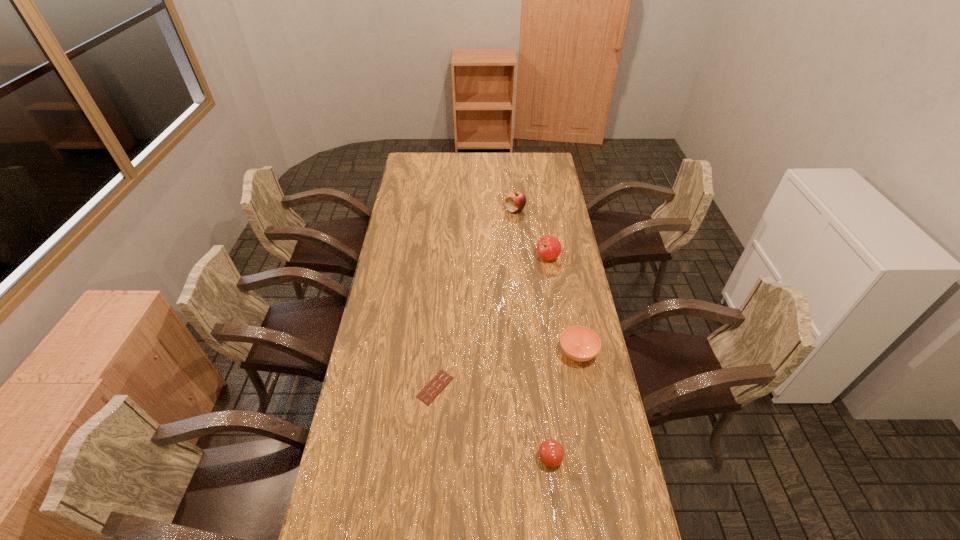
Identify the location of the farthest apple. This screenshot has height=540, width=960. (515, 201).

Locate an element on the screen. the second farthest object is located at coordinates 548,247.

The image size is (960, 540). I want to click on the nearest object, so click(x=551, y=453).

Where is `the shortest apple`? The image size is (960, 540). the shortest apple is located at coordinates (551, 453).

Image resolution: width=960 pixels, height=540 pixels. I want to click on the second shortest object, so click(x=579, y=343).

Find the location of a particular element. the shortest object is located at coordinates (442, 379).

This screenshot has width=960, height=540. I want to click on the leftmost object, so pos(442,379).

Find the location of a particular element. The height and width of the screenshot is (540, 960). vacant space located 0.250m on the back of the farthest apple is located at coordinates tap(512, 177).

I want to click on vacant space located 0.350m on the left of the second nearest apple, so click(455, 258).

Locate an element on the screen. vacant space located 0.100m on the front of the nearest apple is located at coordinates (556, 508).